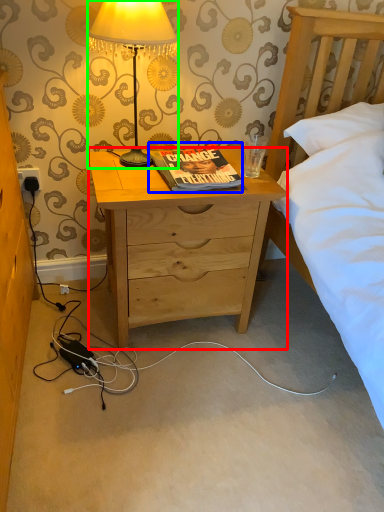
Question: Estimate the real-world distances between objects in this image. Which object is farther from desk (highlighted by a red box), book (highlighted by a blue box) or lamp (highlighted by a green box)?

Choices:
 (A) book
 (B) lamp

Answer: (B)